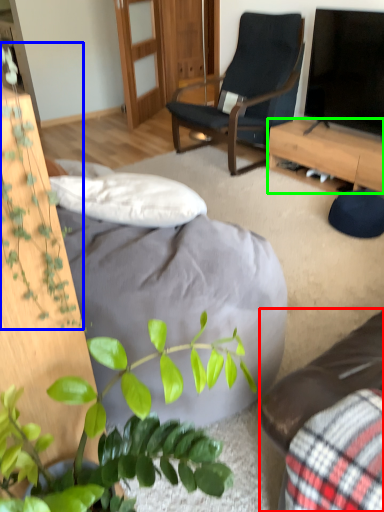
Question: Considering the real-world distances, which object is farthest from studio couch (highlighted by a red box)? vegetation (highlighted by a blue box) or desk (highlighted by a green box)?

Choices:
 (A) vegetation
 (B) desk

Answer: (B)